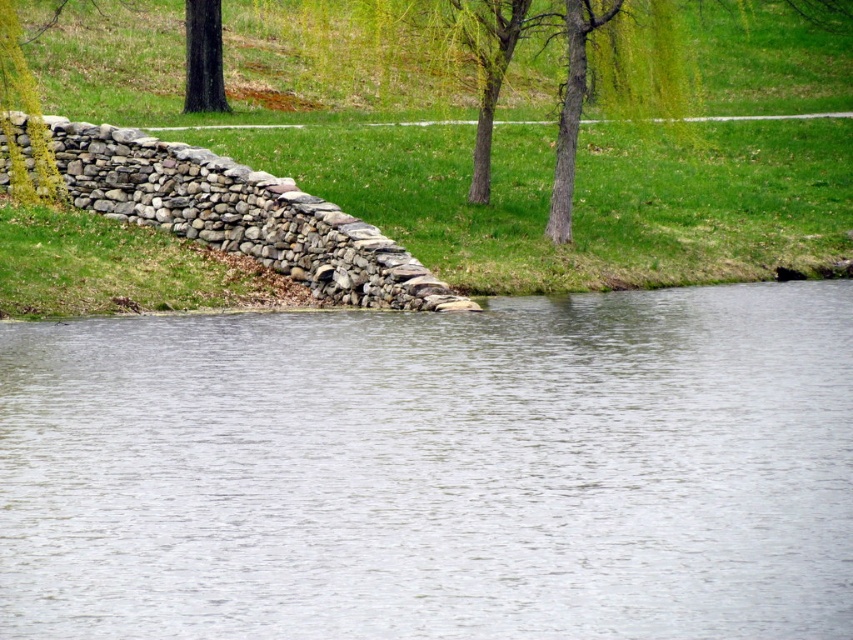
Question: Among these points, which one is nearest to the camera?

Choices:
 (A) (315, 186)
 (B) (212, 22)

Answer: (A)

Question: Does clear water at center have a lesser width compared to dark brown bark tree at upper left?

Choices:
 (A) no
 (B) yes

Answer: (A)

Question: Among these points, which one is nearest to the camera?

Choices:
 (A) (344, 449)
 (B) (552, 250)

Answer: (A)

Question: Is clear water at center positioned before green grass at upper center?

Choices:
 (A) yes
 (B) no

Answer: (A)

Question: Which point appears farthest from the camera in this image?

Choices:
 (A) (531, 269)
 (B) (616, 294)

Answer: (B)

Question: Can you confirm if clear water at center is positioned to the right of dark brown bark tree at upper left?

Choices:
 (A) no
 (B) yes

Answer: (B)